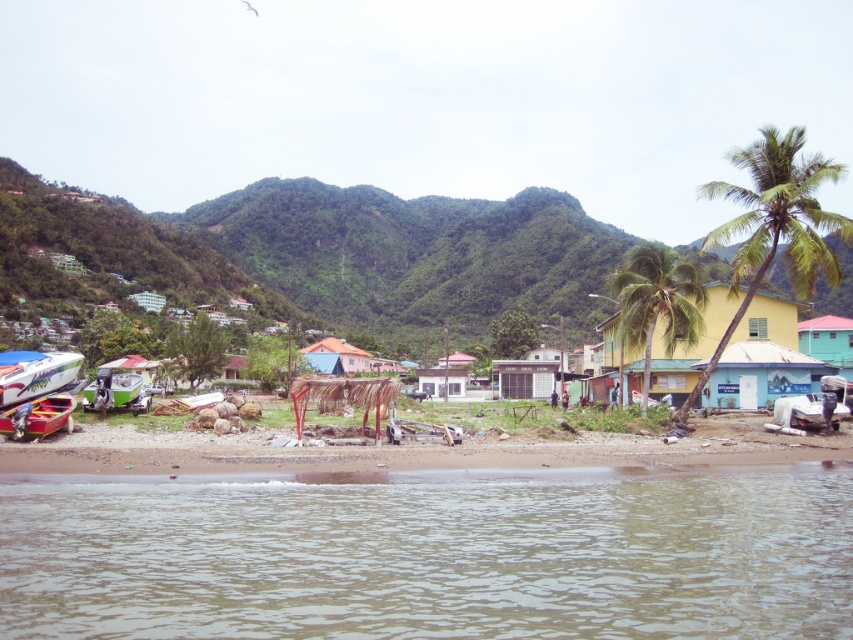
You are planning to store the red plastic boat at lower left inside the blue corrugated metal hut at center. Based on their sizes, will the boat fit inside the hut?

The red plastic boat at lower left is narrower than the blue corrugated metal hut at center, so it should fit inside the hut.

You are a delivery person needing to transport a large package that requires a width of at least 2 meters. You see the red plastic boat at lower left and the green corrugated metal hut at right. Which one can accommodate the package based on their widths?

The green corrugated metal hut at right can accommodate the package since it has a greater width than the red plastic boat at lower left, which is insufficient for the required 2 meters.

You are standing at the edge of the water in this coastal scene. You want to locate the clear water at lower center. According to the coordinates provided, where should you look relative to your position?

The clear water at lower center is located at coordinates point (430,554), which means it is positioned to the right and slightly above your current position at the edge of the water.